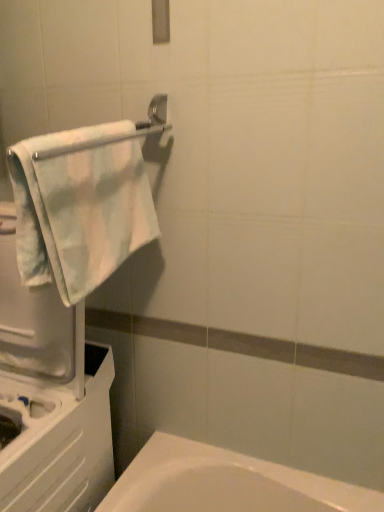
Question: Relative to light blue plush towel at left, is silver metallic towel bar at upper left in front or behind?

Choices:
 (A) behind
 (B) front

Answer: (B)

Question: From a real-world perspective, is silver metallic towel bar at upper left physically located above or below light blue plush towel at left?

Choices:
 (A) above
 (B) below

Answer: (A)

Question: From their relative heights in the image, would you say silver metallic towel bar at upper left is taller or shorter than light blue plush towel at left?

Choices:
 (A) short
 (B) tall

Answer: (A)

Question: From the image's perspective, is light blue plush towel at left above or below silver metallic towel bar at upper left?

Choices:
 (A) below
 (B) above

Answer: (A)

Question: Is light blue plush towel at left taller or shorter than silver metallic towel bar at upper left?

Choices:
 (A) tall
 (B) short

Answer: (A)

Question: Considering the positions of point (49, 190) and point (81, 145), is point (49, 190) closer or farther from the camera than point (81, 145)?

Choices:
 (A) closer
 (B) farther

Answer: (A)

Question: Is light blue plush towel at left wider or thinner than silver metallic towel bar at upper left?

Choices:
 (A) thin
 (B) wide

Answer: (B)